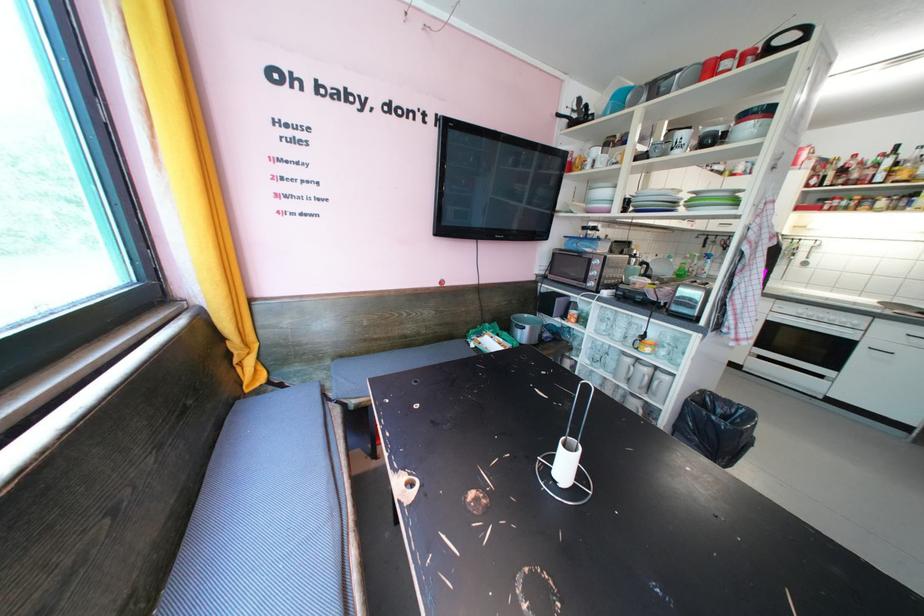
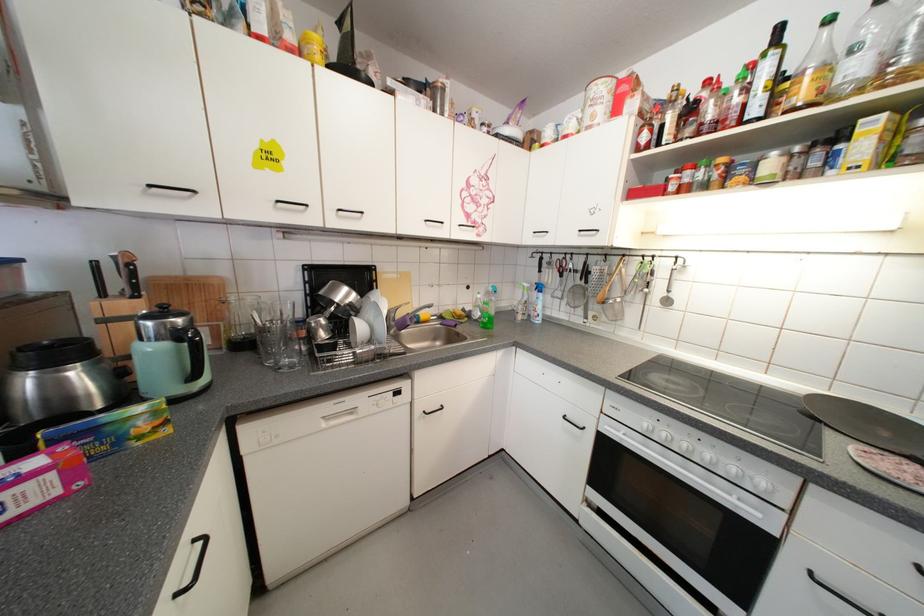
In the second image, find the point that corresponds to the point at 821,171 in the first image.

(650, 116)